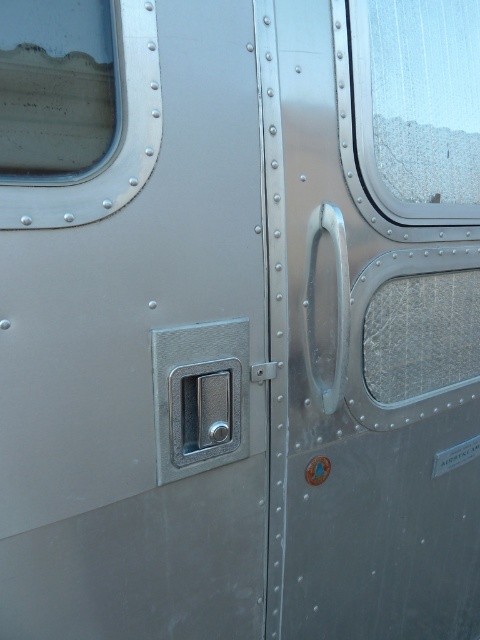
Is metallic silver handle at center right taller than metallic textured window at upper left?

Yes.

Does metallic silver handle at center right appear on the left side of metallic textured window at upper left?

In fact, metallic silver handle at center right is to the right of metallic textured window at upper left.

Is point (338, 362) positioned behind point (12, 28)?

That is True.

Identify the location of metallic silver handle at center right. The image size is (480, 640). (372, 355).

Is metallic silver handle at center right shorter than frosted glass window at upper right?

No.

Between metallic silver handle at center right and frosted glass window at upper right, which one has more height?

With more height is metallic silver handle at center right.

Consider the image. Who is more forward, (310, 381) or (359, 145)?

Positioned in front is point (310, 381).

The width and height of the screenshot is (480, 640). What are the coordinates of `metallic silver handle at center right` in the screenshot? It's located at (372, 355).

Which of these two, frosted glass window at upper right or polished metal handle at center, stands shorter?

Standing shorter between the two is polished metal handle at center.

Consider the image. Is frosted glass window at upper right further to camera compared to polished metal handle at center?

Yes, it is behind polished metal handle at center.

Describe the element at coordinates (372, 140) in the screenshot. I see `frosted glass window at upper right` at that location.

You are a GUI agent. You are given a task and a screenshot of the screen. Output one action in this format:
    pyautogui.click(x=<x>, y=<y>)
    Task: Click on the frosted glass window at upper right
    
    Given the screenshot: What is the action you would take?
    pyautogui.click(x=372, y=140)